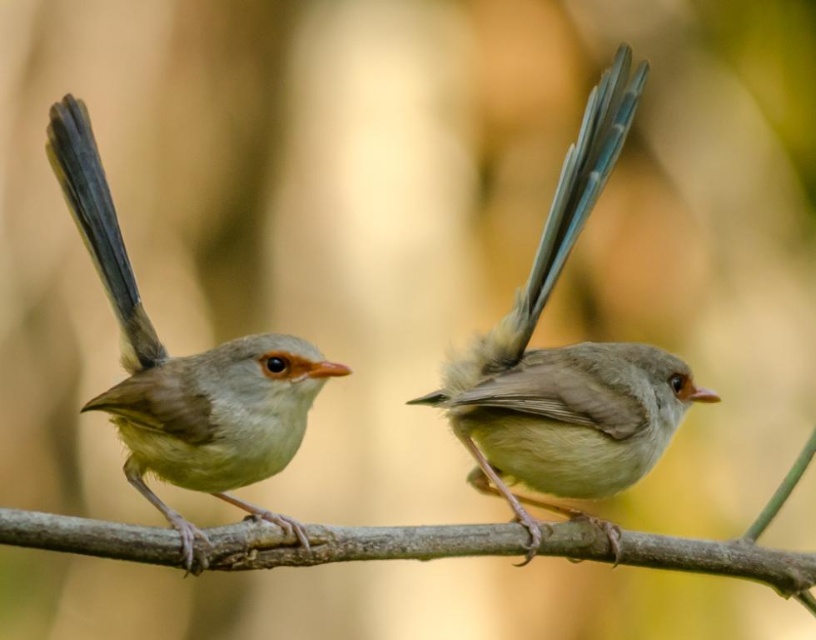
Question: Among these objects, which one is farthest from the camera?

Choices:
 (A) smooth brown bird at left
 (B) smooth gray bird at center
 (C) brown smooth branch at center

Answer: (B)

Question: Does smooth gray bird at center appear over smooth brown bird at left?

Choices:
 (A) yes
 (B) no

Answer: (A)

Question: Based on their relative distances, which object is farther from the brown smooth branch at center?

Choices:
 (A) smooth brown bird at left
 (B) smooth gray bird at center

Answer: (B)

Question: Does smooth gray bird at center appear on the left side of smooth brown bird at left?

Choices:
 (A) no
 (B) yes

Answer: (A)

Question: Considering the real-world distances, which object is closest to the smooth brown bird at left?

Choices:
 (A) brown smooth branch at center
 (B) smooth gray bird at center

Answer: (A)

Question: Is smooth brown bird at left bigger than brown smooth branch at center?

Choices:
 (A) no
 (B) yes

Answer: (A)